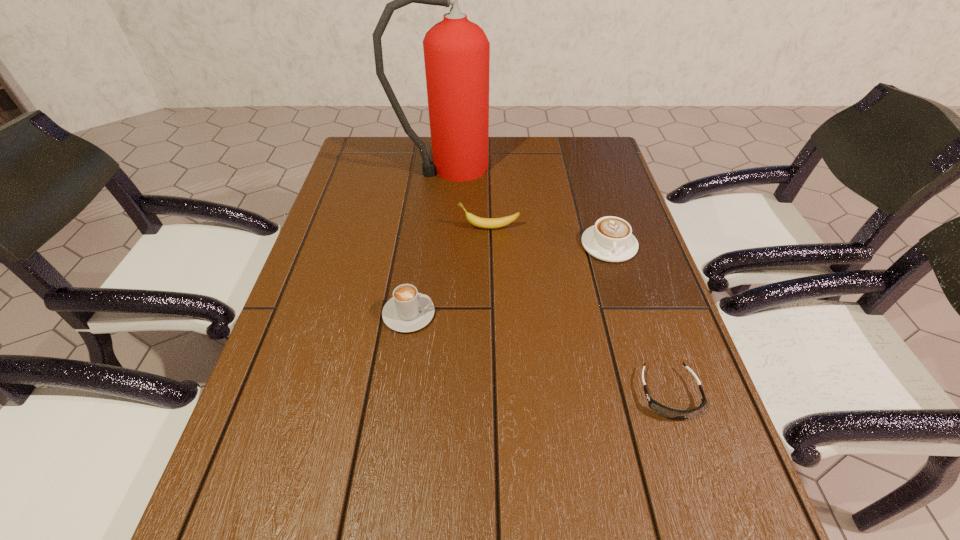
Identify the location of free space between the tallest object and the left cappuccino. This screenshot has width=960, height=540. (427, 241).

The height and width of the screenshot is (540, 960). I want to click on vacant space that is in between the nearer cappuccino and the shortest object, so click(x=540, y=354).

Where is `free space between the banana and the farthest object`? free space between the banana and the farthest object is located at coordinates (468, 198).

Identify the location of vacant point located between the fourth tallest object and the second nearest object. (509, 279).

Where is `free space between the tallest object and the shortest object`? free space between the tallest object and the shortest object is located at coordinates (558, 281).

Locate an element on the screen. This screenshot has height=540, width=960. free space that is in between the farthest object and the goggles is located at coordinates (558, 281).

You are a GUI agent. You are given a task and a screenshot of the screen. Output one action in this format:
    pyautogui.click(x=<x>, y=<y>)
    Task: Click on the object that stands as the second closest to the shortest object
    
    Given the screenshot: What is the action you would take?
    pyautogui.click(x=407, y=311)

You are a GUI agent. You are given a task and a screenshot of the screen. Output one action in this format:
    pyautogui.click(x=<x>, y=<y>)
    Task: Click on the object that ranks as the second closest to the goggles
    This screenshot has width=960, height=540.
    Given the screenshot: What is the action you would take?
    pyautogui.click(x=407, y=311)

Locate an element on the screen. This screenshot has height=540, width=960. free spot that satisfies the following two spatial constraints: 1. with the handle on the right side of the farther cappuccino; 2. to the right of the nearer cappuccino is located at coordinates (630, 314).